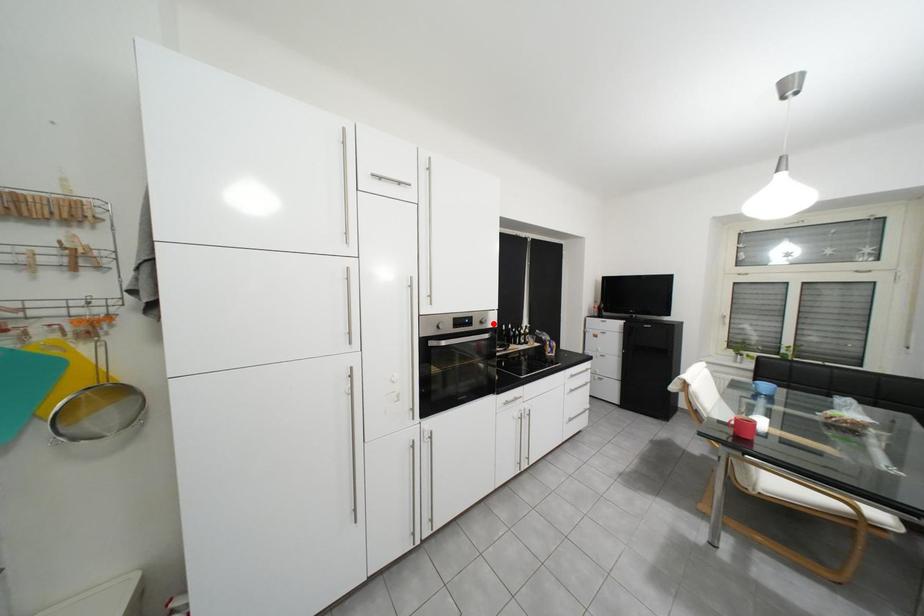
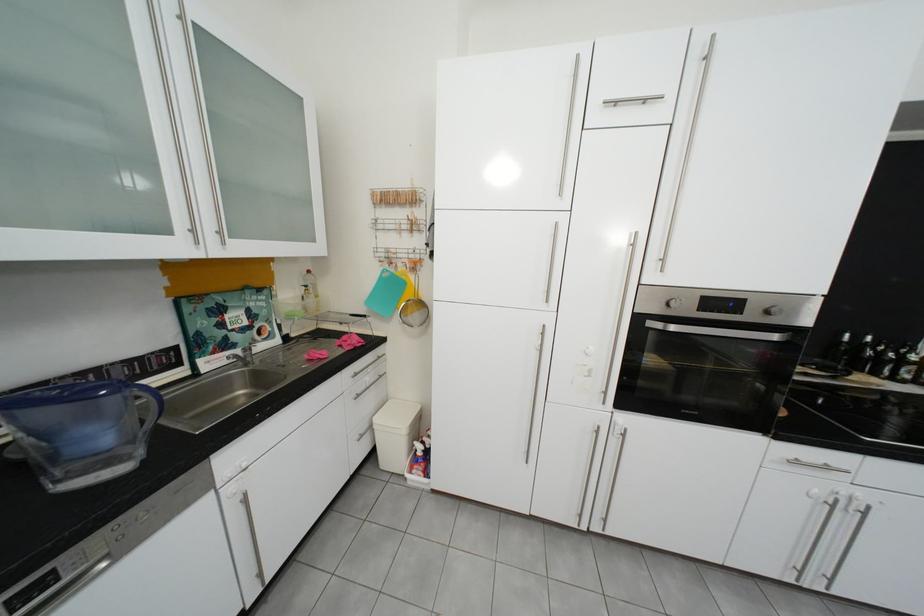
The point at the highlighted location is marked in the first image. Where is the corresponding point in the second image?

(779, 314)